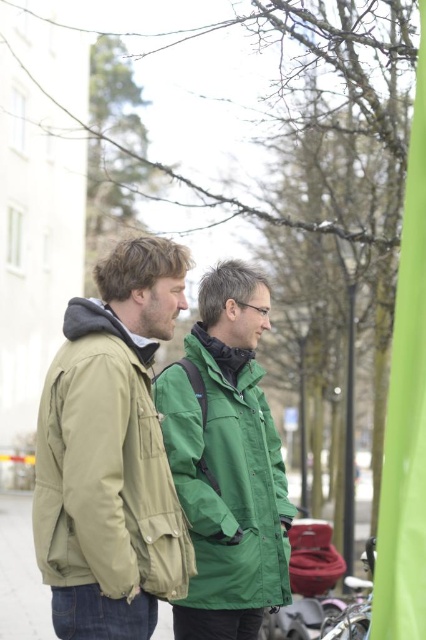
Question: Is matte green jacket at center to the right of olive green jacket at left from the viewer's perspective?

Choices:
 (A) yes
 (B) no

Answer: (A)

Question: Observing the image, what is the correct spatial positioning of olive green jacket at left in reference to green matte jacket at center?

Choices:
 (A) right
 (B) left

Answer: (B)

Question: Which of the following is the farthest from the observer?

Choices:
 (A) green matte jacket at center
 (B) matte green jacket at center

Answer: (A)

Question: Can you confirm if matte green jacket at center is smaller than green matte jacket at center?

Choices:
 (A) yes
 (B) no

Answer: (A)

Question: Which point is closer to the camera?

Choices:
 (A) matte green jacket at center
 (B) olive green jacket at left

Answer: (B)

Question: Which of the following is the farthest from the observer?

Choices:
 (A) matte green jacket at center
 (B) green matte jacket at center
 (C) olive green jacket at left

Answer: (B)